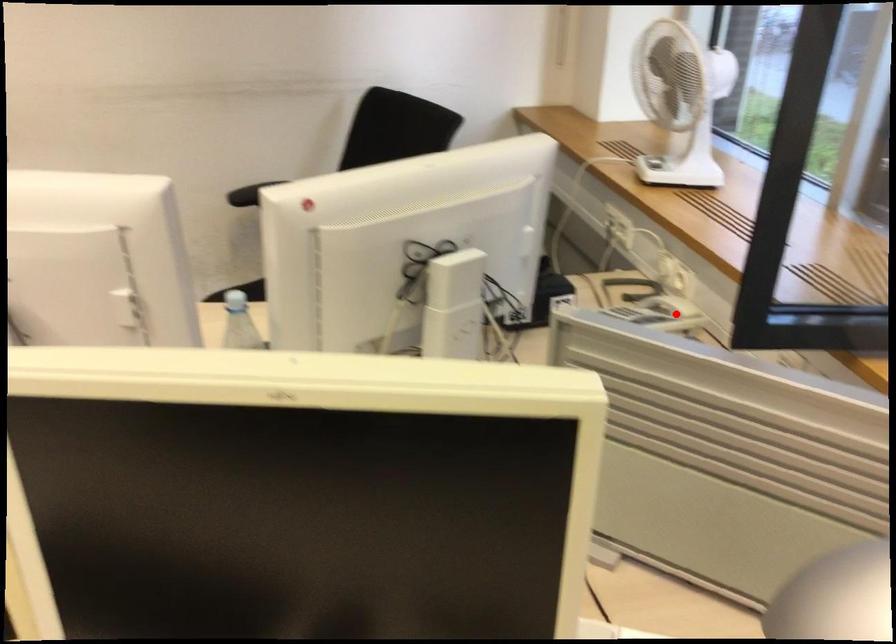
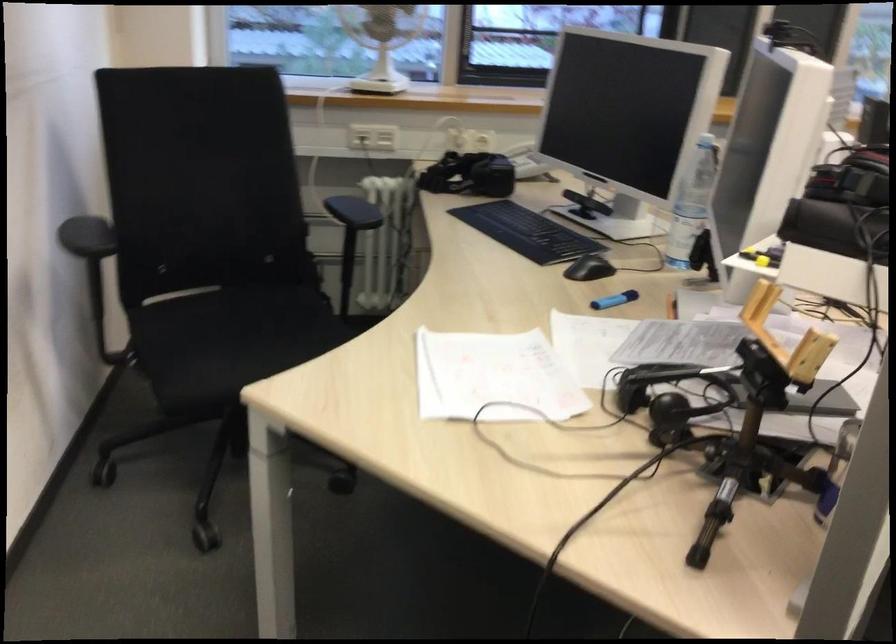
In the second image, find the point that corresponds to the highlighted location in the first image.

(519, 149)